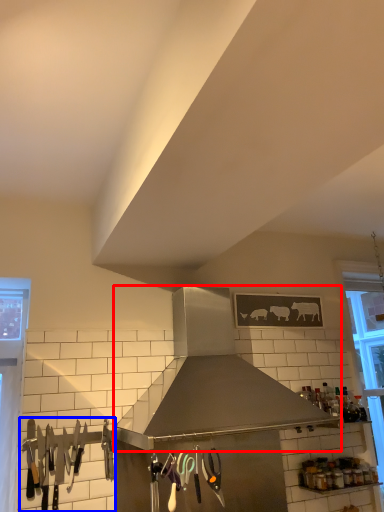
Question: Which object appears farthest to the camera in this image, kitchen appliance (highlighted by a red box) or silverware (highlighted by a blue box)?

Choices:
 (A) kitchen appliance
 (B) silverware

Answer: (B)